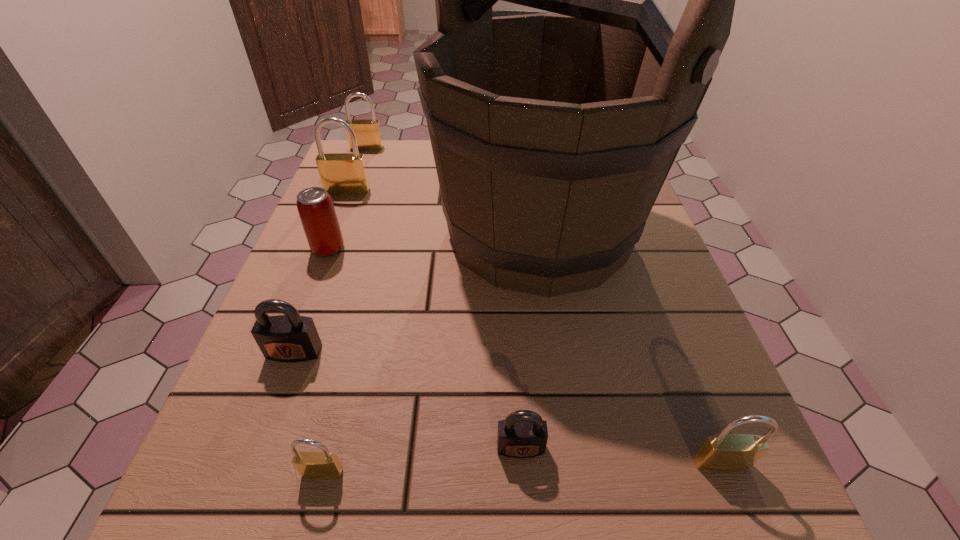
This screenshot has width=960, height=540. I want to click on unoccupied area between the bigger gray padlock and the fifth object from left to right, so click(308, 413).

The image size is (960, 540). What are the coordinates of `vacant point located between the farthest padlock and the pink beer can` in the screenshot? It's located at (348, 198).

Identify which object is the second closest to the smallest brass padlock. Please provide its 2D coordinates. Your answer should be formatted as a tuple, i.e. [(x, y)], where the tuple contains the x and y coordinates of a point satisfying the conditions above.

[(523, 434)]

Locate which object ranks second in proximity to the second biggest brass padlock. Please provide its 2D coordinates. Your answer should be formatted as a tuple, i.e. [(x, y)], where the tuple contains the x and y coordinates of a point satisfying the conditions above.

[(552, 135)]

Where is `the third closest padlock relative to the smallest brass padlock`? the third closest padlock relative to the smallest brass padlock is located at coordinates (724, 452).

What are the coordinates of `padlock object that ranks as the second closest to the beer can` in the screenshot? It's located at (289, 338).

Point out which brass padlock is positioned as the third nearest to the pink beer can. Please provide its 2D coordinates. Your answer should be formatted as a tuple, i.e. [(x, y)], where the tuple contains the x and y coordinates of a point satisfying the conditions above.

[(310, 465)]

Choose which brass padlock is the nearest neighbor to the smallest brass padlock. Please provide its 2D coordinates. Your answer should be formatted as a tuple, i.e. [(x, y)], where the tuple contains the x and y coordinates of a point satisfying the conditions above.

[(724, 452)]

Where is `vacant point that satisfies the following two spatial constraints: 1. on the front-facing side of the bucket; 2. on the left side of the second farthest brass padlock`? Image resolution: width=960 pixels, height=540 pixels. vacant point that satisfies the following two spatial constraints: 1. on the front-facing side of the bucket; 2. on the left side of the second farthest brass padlock is located at coordinates (331, 232).

Locate an element on the screen. This screenshot has width=960, height=540. vacant space that satisfies the following two spatial constraints: 1. on the front-facing side of the tallest object; 2. on the left side of the second tallest object is located at coordinates (331, 232).